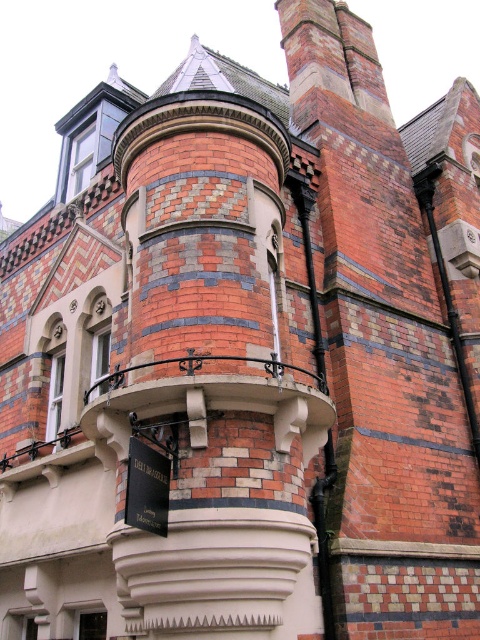
Question: Is black matte sign at lower center thinner than white plastic clock at upper center?

Choices:
 (A) no
 (B) yes

Answer: (A)

Question: Among these objects, which one is farthest from the camera?

Choices:
 (A) black matte sign at lower center
 (B) white plastic clock at upper center

Answer: (B)

Question: Which point is closer to the camera?

Choices:
 (A) white plastic clock at upper center
 (B) black matte sign at lower center

Answer: (B)

Question: Is the position of black matte sign at lower center less distant than that of white plastic clock at upper center?

Choices:
 (A) yes
 (B) no

Answer: (A)

Question: Is black matte sign at lower center positioned in front of white plastic clock at upper center?

Choices:
 (A) no
 (B) yes

Answer: (B)